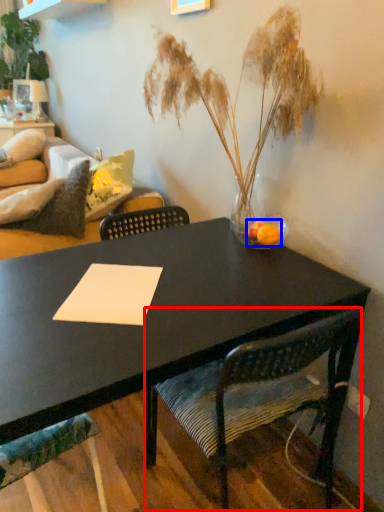
Question: Which object is further to the camera taking this photo, chair (highlighted by a red box) or flower (highlighted by a blue box)?

Choices:
 (A) chair
 (B) flower

Answer: (B)